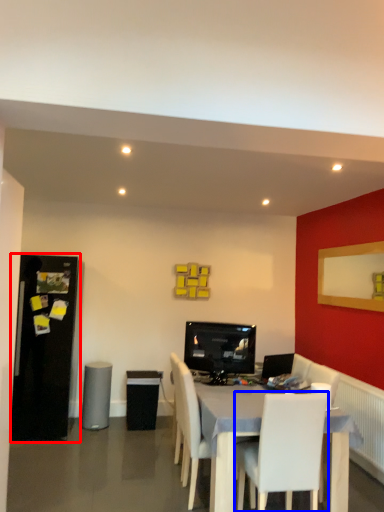
Question: Which object is closer to the camera taking this photo, fridge (highlighted by a red box) or chair (highlighted by a blue box)?

Choices:
 (A) fridge
 (B) chair

Answer: (B)